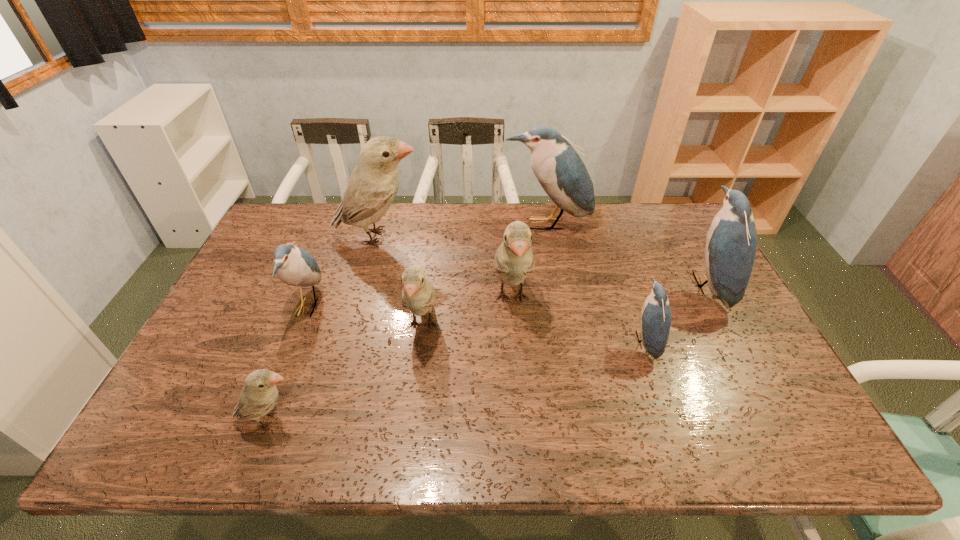
The width and height of the screenshot is (960, 540). Identify the location of the nearest bird. (259, 395).

Find the location of a particular element. the nearest object is located at coordinates (259, 395).

This screenshot has height=540, width=960. What are the coordinates of `vacant space positioned 0.160m at the tip of the third blue bird from right to left's beak` in the screenshot? It's located at (554, 267).

At what (x,y) coordinates should I click in order to perform the action: click on vacant space located 0.290m at the face of the farthest white bird. Please return your answer as a coordinate pair (x, y). Image resolution: width=960 pixels, height=540 pixels. Looking at the image, I should click on (509, 237).

Locate an element on the screen. This screenshot has height=540, width=960. free space located 0.390m at the tip of the second biggest blue bird's beak is located at coordinates (560, 285).

Identify the location of vacant area situated at the tip of the second biggest blue bird's beak. The height and width of the screenshot is (540, 960). (586, 285).

This screenshot has height=540, width=960. Find the location of `free space located at the tip of the second biggest blue bird's beak`. free space located at the tip of the second biggest blue bird's beak is located at coordinates (619, 285).

The image size is (960, 540). In order to click on free location located 0.200m at the face of the third smallest white bird in this screenshot , I will do `click(519, 397)`.

Where is `free space located at the tip of the leftmost blue bird's beak`? Image resolution: width=960 pixels, height=540 pixels. free space located at the tip of the leftmost blue bird's beak is located at coordinates (418, 307).

I want to click on free region located at the face of the third biggest white bird, so click(412, 408).